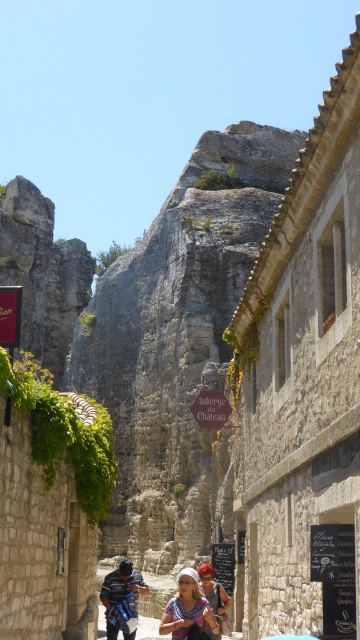
You are a tourist standing on the cobblestone street in the village. You notice a person with blonde hair at center and a matte white shirt at center. Which of these items is higher up on their body?

The blonde hair at center is taller than the matte white shirt at center, so the blonde hair is higher up on their body.